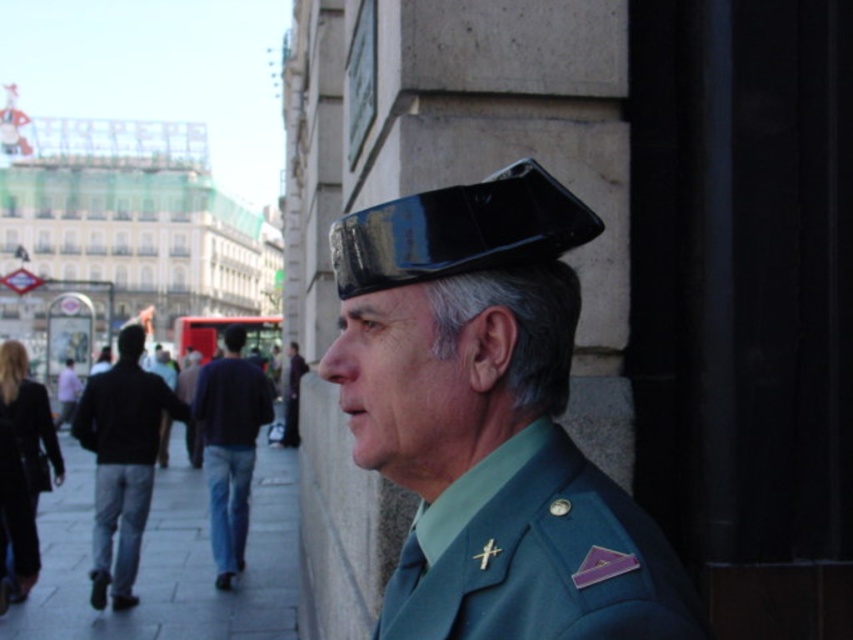
You are a photographer trying to capture a photo of the teal fabric uniform at center and blue jeans at lower left in the same frame. Based on their positions, can you determine which object is closer to the left side of the image?

The teal fabric uniform at center is to the right of blue jeans at lower left, so the blue jeans at lower left is closer to the left side of the image.

You are standing at the center of the city street scene. There is a black glossy hat at upper center located at point (459, 230). Can you tell me what object is exactly at that coordinate?

The object exactly at point (459, 230) is the black glossy hat at upper center.